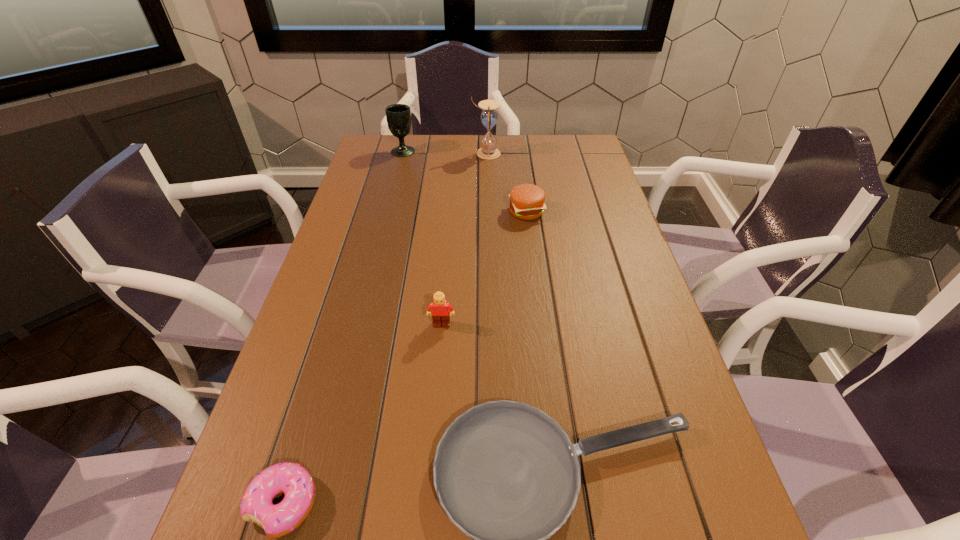
The image size is (960, 540). I want to click on hourglass present at the far edge, so click(x=489, y=117).

Locate an element on the screen. This screenshot has width=960, height=540. chalice that is at the far edge is located at coordinates (398, 116).

Where is `object present at the left edge`? Image resolution: width=960 pixels, height=540 pixels. object present at the left edge is located at coordinates (398, 116).

Where is `object at the far left corner`? object at the far left corner is located at coordinates 398,116.

In the image, there is a desktop. Identify the location of free space at the far edge. The width and height of the screenshot is (960, 540). (471, 165).

Locate an element on the screen. This screenshot has height=540, width=960. free region at the left edge of the desktop is located at coordinates (368, 192).

Locate an element on the screen. This screenshot has width=960, height=540. vacant space at the far left corner of the desktop is located at coordinates (400, 168).

I want to click on vacant area that lies between the fifth shortest object and the third farthest object, so click(x=465, y=181).

I want to click on vacant space in between the fourth shortest object and the fourth nearest object, so click(x=484, y=268).

This screenshot has width=960, height=540. What are the coordinates of `free area in between the second tallest object and the tallest object` in the screenshot? It's located at (444, 152).